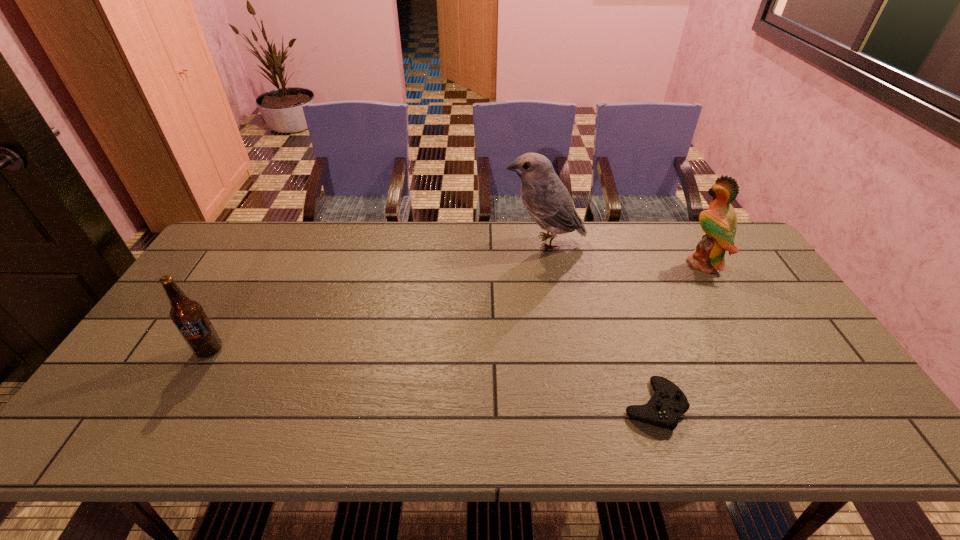
Identify the location of vacant space that satisfies the following two spatial constraints: 1. on the front-facing side of the rightmost object; 2. on the front side of the shortest object. (785, 405).

This screenshot has width=960, height=540. Identify the location of free spot that satisfies the following two spatial constraints: 1. on the label of the control; 2. on the left side of the third farthest object. (178, 405).

Identify the location of vacant space that satisfies the following two spatial constraints: 1. on the front-facing side of the shortest object; 2. on the left side of the left parrot. The width and height of the screenshot is (960, 540). (572, 405).

You are a GUI agent. You are given a task and a screenshot of the screen. Output one action in this format:
    pyautogui.click(x=<x>, y=<y>)
    Task: Click on the vacant space that satisfies the following two spatial constraints: 1. on the front-facing side of the left parrot; 2. on the label of the leftmost object
    
    Given the screenshot: What is the action you would take?
    pyautogui.click(x=563, y=350)

This screenshot has width=960, height=540. In order to click on free location that satisfies the following two spatial constraints: 1. on the front-facing side of the rightmost object; 2. on the label of the second nearest object in this screenshot , I will do `click(754, 350)`.